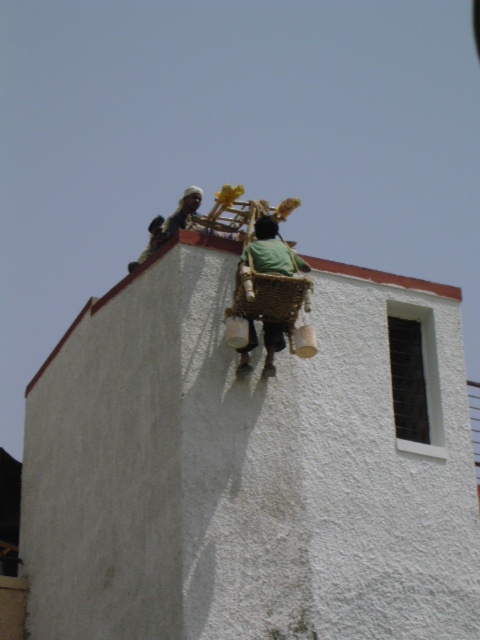
In the scene shown: You are on the roof and need to choose between the green woven basket at upper center and the light brown wicker basket at upper center to place a heavy tool. Which basket should you choose based on their heights?

The light brown wicker basket at upper center is taller than the green woven basket at upper center, so you should choose the light brown wicker basket at upper center to place the heavy tool.

From the picture: You are on the roof and need to reach a tool located at point (282, 252). There is also a safety harness at point (184, 189). Which item is closer to you?

Point (282, 252) is closer to the camera than point (184, 189), so the tool is closer to you than the safety harness.

You are standing on the roof and need to place a new ladder. The ladder must be placed so that its base is exactly 0.3 meters away from the green woven basket at upper center. Where should you place the base of the ladder relative to the basket?

The base of the ladder should be placed 0.3 meters away from the green woven basket at upper center.